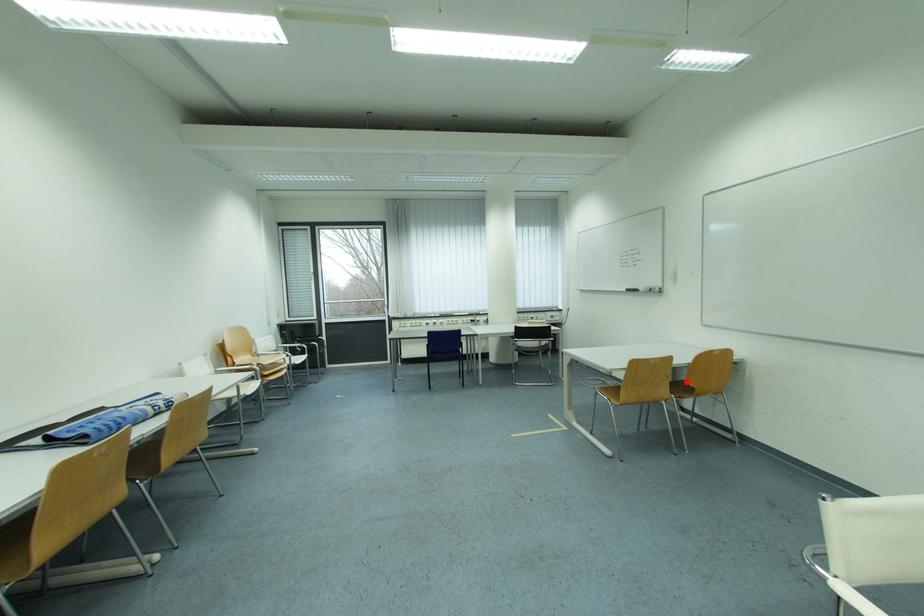
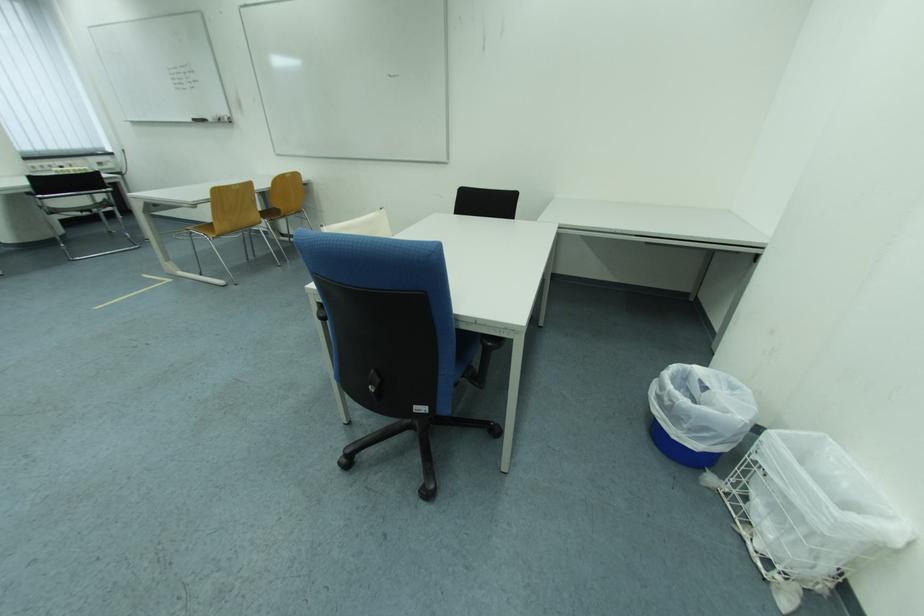
Locate, in the second image, the point that corresponds to the highlighted location in the first image.

(277, 211)